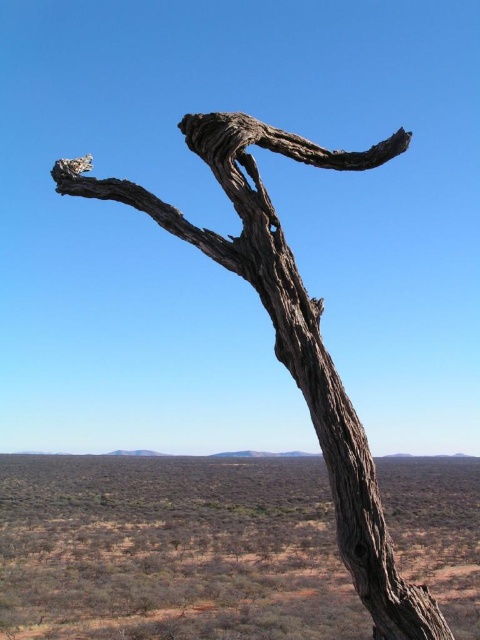
Does brown dry grass at lower left have a greater width compared to gray rough bark tree at center?

Indeed, brown dry grass at lower left has a greater width compared to gray rough bark tree at center.

Can you confirm if brown dry grass at lower left is positioned to the left of gray rough bark tree at center?

Correct, you'll find brown dry grass at lower left to the left of gray rough bark tree at center.

Who is more forward, (20, 584) or (395, 138)?

Point (395, 138) is more forward.

Identify the location of brown dry grass at lower left. This screenshot has height=640, width=480. (170, 550).